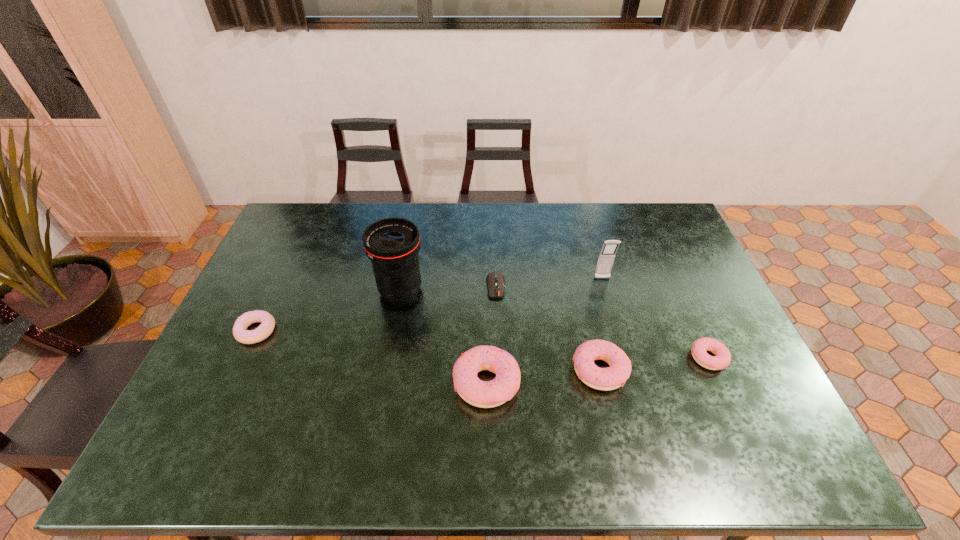
At what (x,y) coordinates should I click in order to perform the action: click on vacant space located 0.290m on the back of the second doughnut from left to right. Please return your answer as a coordinate pair (x, y). Looking at the image, I should click on (486, 282).

Where is `vacant region located 0.050m on the right of the third shortest doughnut`? This screenshot has width=960, height=540. vacant region located 0.050m on the right of the third shortest doughnut is located at coordinates (647, 370).

In order to click on free region located 0.090m on the front of the rightmost object in this screenshot , I will do `click(729, 404)`.

You are a GUI agent. You are given a task and a screenshot of the screen. Output one action in this format:
    pyautogui.click(x=<x>, y=<y>)
    Task: Click on the free point located 0.390m on the right of the sixth object from right to left
    
    Given the screenshot: What is the action you would take?
    pyautogui.click(x=549, y=290)

Find the location of a particular element. vacant space located 0.240m on the right of the leftmost object is located at coordinates (359, 331).

This screenshot has width=960, height=540. I want to click on free location located 0.210m on the front-facing side of the cellular telephone, so click(x=617, y=332).

Identify the location of vacant region located on the button of the computer equipment. (499, 370).

This screenshot has height=540, width=960. What are the coordinates of `object that is at the left edge` in the screenshot? It's located at (267, 325).

In order to click on object at the right edge in this screenshot , I will do `click(721, 360)`.

At what (x,y) coordinates should I click in order to perform the action: click on vacant space at the far edge of the desktop. Please return your answer as a coordinate pair (x, y). Image resolution: width=960 pixels, height=540 pixels. Looking at the image, I should click on (466, 206).